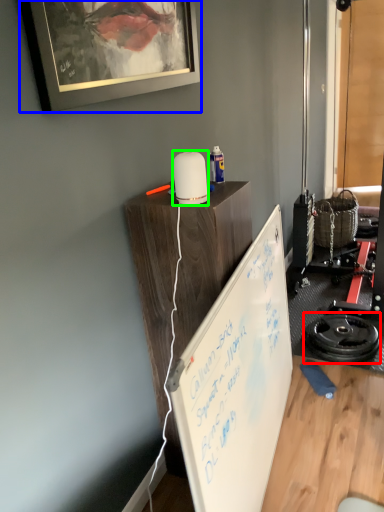
Question: Which is farther away from wheel (highlighted by a red box)? picture frame (highlighted by a blue box) or appliance (highlighted by a green box)?

Choices:
 (A) picture frame
 (B) appliance

Answer: (A)